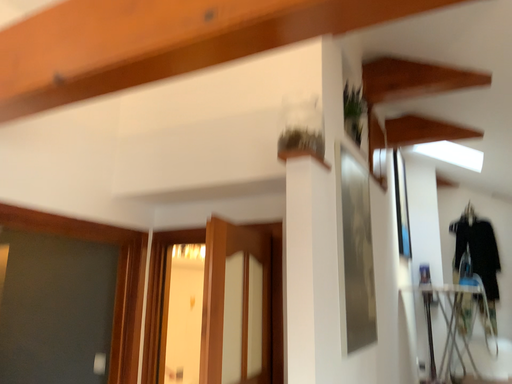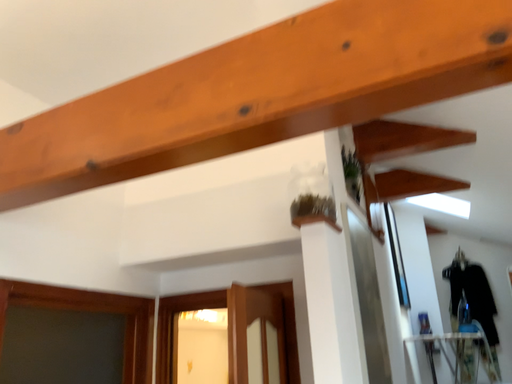
Question: Which way did the camera rotate in the video?

Choices:
 (A) rotated downward
 (B) rotated upward

Answer: (B)